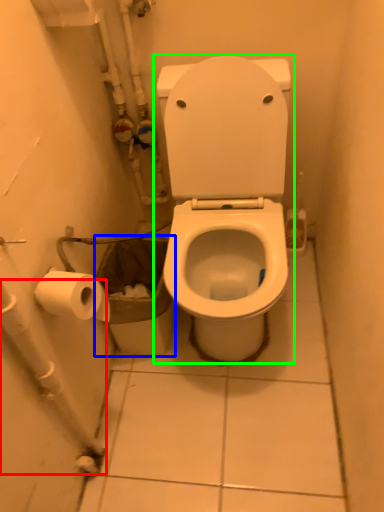
Question: Which object is the farthest from water pipe (highlighted by a red box)? Choose among these: garbage (highlighted by a blue box) or toilet (highlighted by a green box).

Choices:
 (A) garbage
 (B) toilet

Answer: (B)